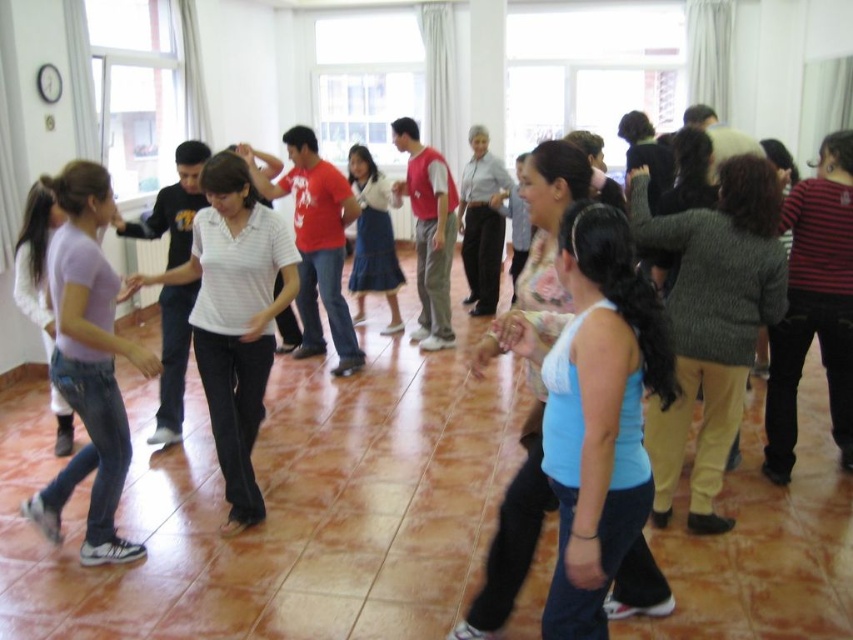
Question: Is white matte shirt at center further to camera compared to denim skirt at center?

Choices:
 (A) no
 (B) yes

Answer: (A)

Question: Does white matte shirt at center have a smaller size compared to denim skirt at center?

Choices:
 (A) no
 (B) yes

Answer: (A)

Question: Which of these objects is positioned closest to the light purple cotton t-shirt at left?

Choices:
 (A) denim skirt at center
 (B) white matte shirt at center

Answer: (B)

Question: Estimate the real-world distances between objects in this image. Which object is farther from the light purple cotton t-shirt at left?

Choices:
 (A) denim skirt at center
 (B) white matte shirt at center

Answer: (A)

Question: Where is light purple cotton t-shirt at left located in relation to denim skirt at center in the image?

Choices:
 (A) left
 (B) right

Answer: (A)

Question: Which object appears farthest from the camera in this image?

Choices:
 (A) light purple cotton t-shirt at left
 (B) denim skirt at center
 (C) white matte shirt at center

Answer: (B)